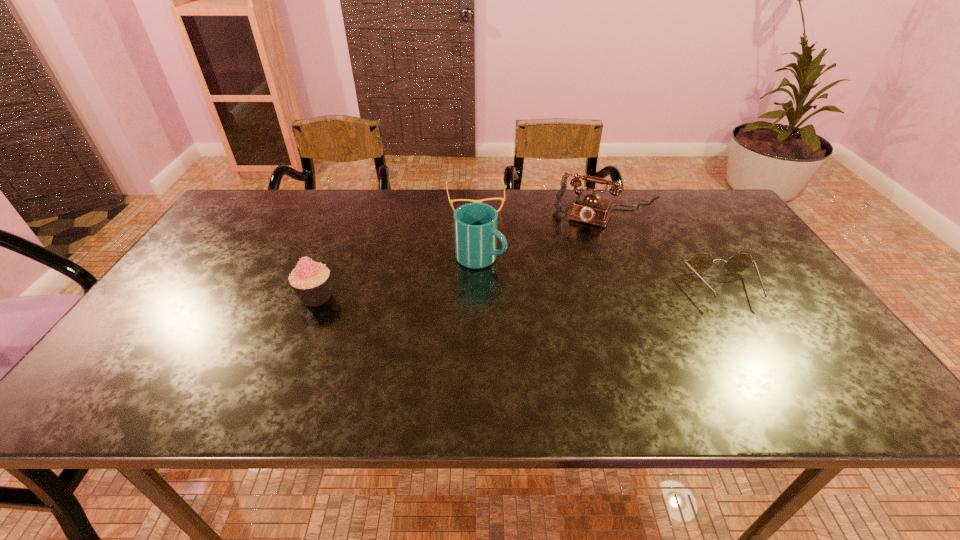
At what (x,y) coordinates should I click in order to perform the action: click on vacant space on the desktop that is between the cupcake and the taller spectacles and is positioned on the handle side of the cup. Please return your answer as a coordinate pair (x, y). This screenshot has width=960, height=540. Looking at the image, I should click on (568, 292).

You are a GUI agent. You are given a task and a screenshot of the screen. Output one action in this format:
    pyautogui.click(x=<x>, y=<y>)
    Task: Click on the vacant space on the desktop that is between the cupcake and the second shortest object and is positioned on the dial of the telephone
    
    Given the screenshot: What is the action you would take?
    (x=578, y=291)

Where is `vacant space on the desktop that is between the cupcake and the second shortest object and is positioned in front of the lenses of the shortest object`? vacant space on the desktop that is between the cupcake and the second shortest object and is positioned in front of the lenses of the shortest object is located at coordinates (487, 293).